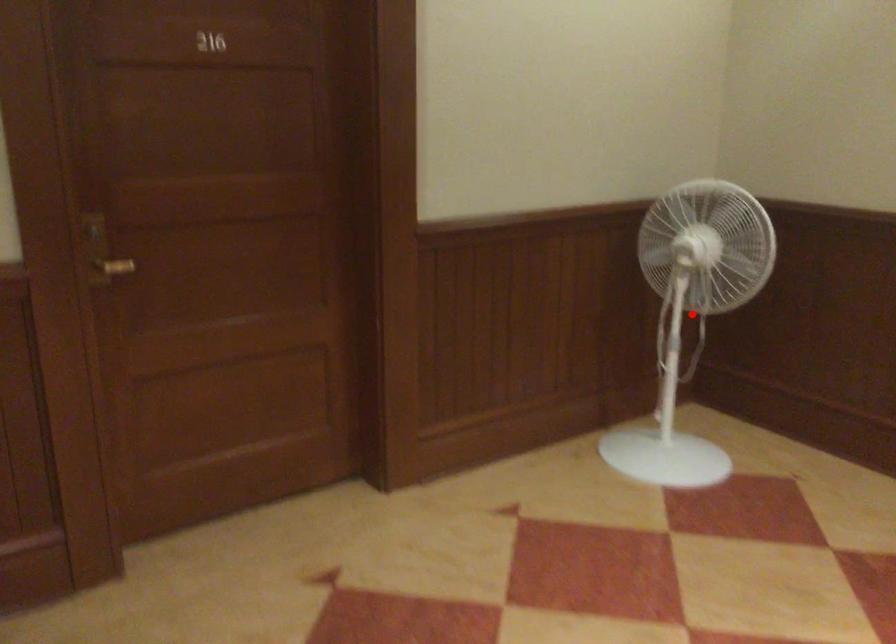
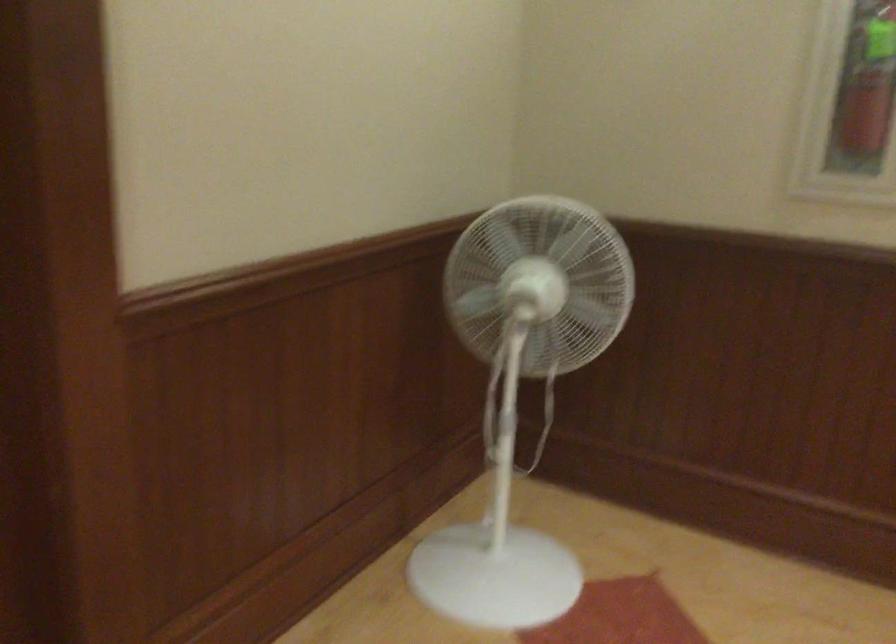
Question: I am providing you with two images of the same scene from different viewpoints. A red point is marked on the first image. Is the red point's position out of view in image 2?

Choices:
 (A) Yes
 (B) No

Answer: (A)